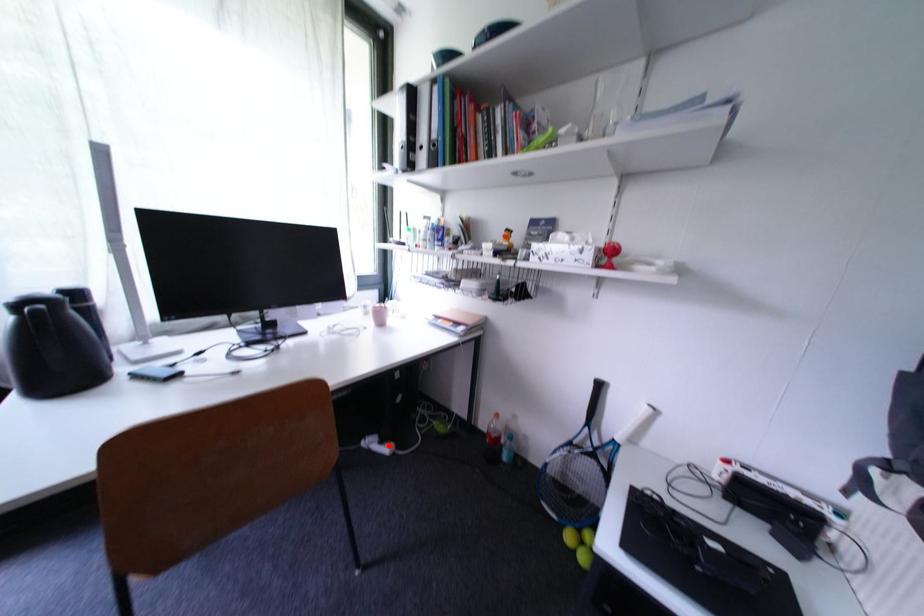
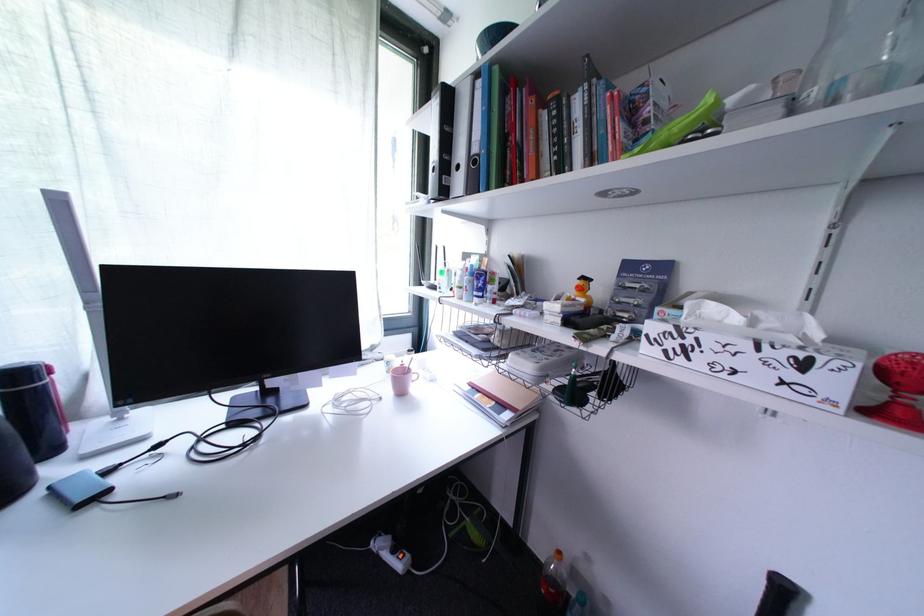
Question: A red point is marked in image1. In image2, is the corresponding 3D point closer to the camera or farther? Reply with the corresponding letter.

Choices:
 (A) The corresponding 3D point is closer.
 (B) The corresponding 3D point is farther.

Answer: (B)